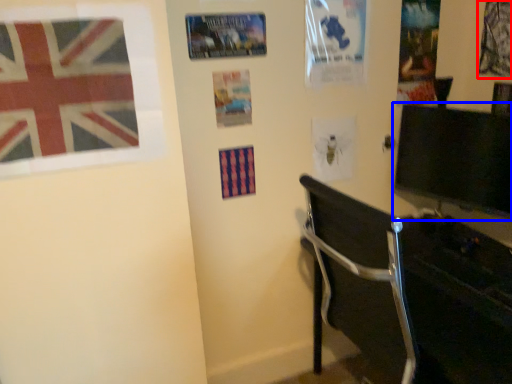
Question: Among these objects, which one is nearest to the camera, poster page (highlighted by a red box) or computer monitor (highlighted by a blue box)?

Choices:
 (A) poster page
 (B) computer monitor

Answer: (B)